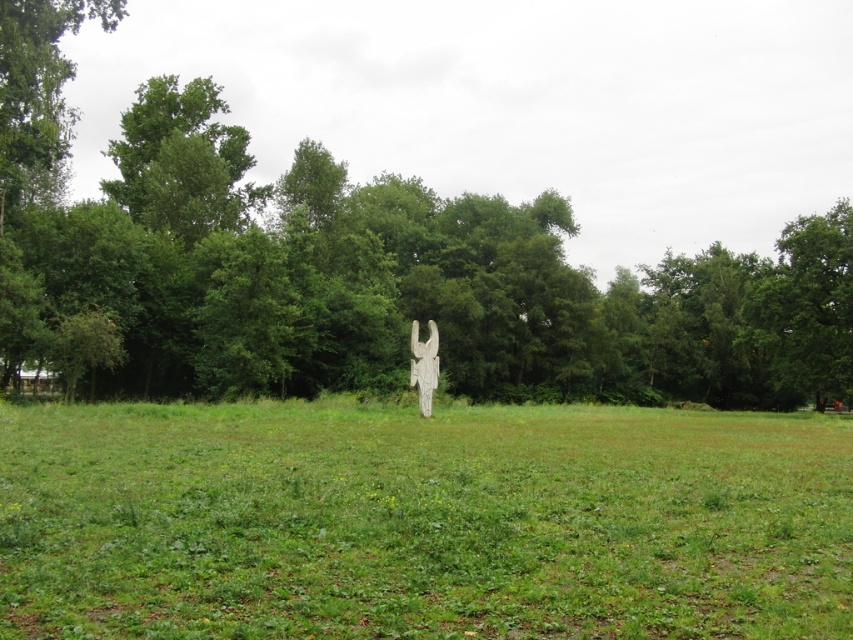
Who is higher up, green grass at center or white stone statue at center?

white stone statue at center is above.

Does green grass at center appear on the right side of white stone statue at center?

Incorrect, green grass at center is not on the right side of white stone statue at center.

Between point (387, 490) and point (427, 381), which one is positioned in front?

Point (387, 490) is in front.

Where is `green grass at center`? The height and width of the screenshot is (640, 853). green grass at center is located at coordinates (422, 522).

Is the position of green leafy tree at center less distant than that of white stone statue at center?

Yes, green leafy tree at center is closer to the viewer.

Between point (18, 108) and point (410, 348), which one is positioned behind?

The point (18, 108) is behind.

This screenshot has height=640, width=853. Identify the location of green leafy tree at center. (361, 269).

Who is higher up, green grass at center or green leafy tree at center?

Positioned higher is green leafy tree at center.

Does green grass at center have a larger size compared to green leafy tree at center?

No.

Between point (219, 618) and point (0, 260), which one is positioned in front?

Positioned in front is point (219, 618).

You are a GUI agent. You are given a task and a screenshot of the screen. Output one action in this format:
    pyautogui.click(x=<x>, y=<y>)
    Task: Click on the green grass at center
    This screenshot has width=853, height=640.
    Given the screenshot: What is the action you would take?
    pyautogui.click(x=422, y=522)